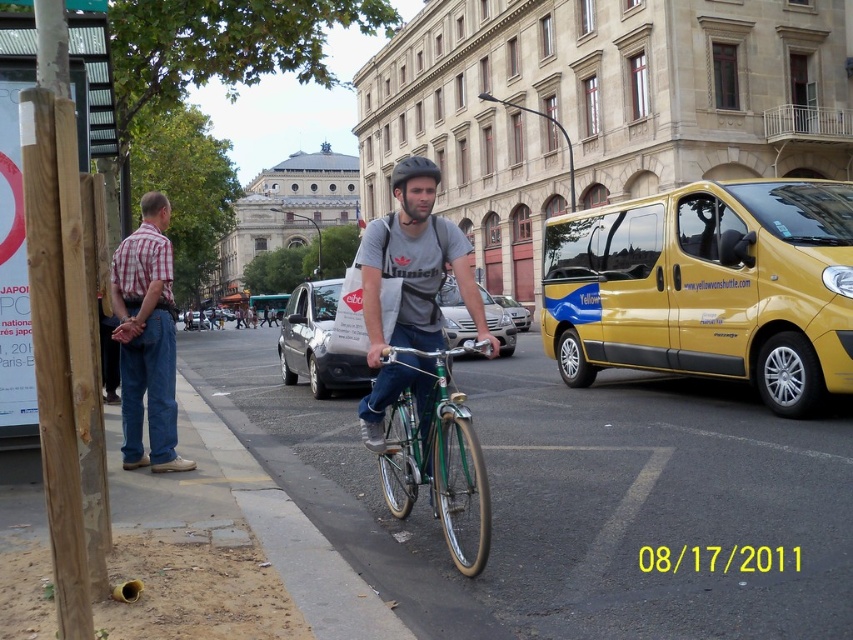
Can you confirm if green metallic bicycle at center is smaller than silver metallic van at center?

Yes.

Does green metallic bicycle at center have a greater height compared to silver metallic van at center?

No, green metallic bicycle at center is not taller than silver metallic van at center.

Find the location of a particular element. green metallic bicycle at center is located at coordinates (436, 452).

Where is `green metallic bicycle at center`? The image size is (853, 640). green metallic bicycle at center is located at coordinates (436, 452).

Is plaid shirt at left further to the viewer compared to matte gray van at center?

Yes.

Who is more forward, (111, 296) or (508, 330)?

Positioned in front is point (111, 296).

Who is more forward, (165,452) or (358,365)?

Point (165,452)

This screenshot has width=853, height=640. I want to click on plaid shirt at left, so click(x=146, y=339).

Does yellow metallic van at right have a greater width compared to matte black helmet at center?

Incorrect, yellow metallic van at right's width does not surpass matte black helmet at center's.

You are a GUI agent. You are given a task and a screenshot of the screen. Output one action in this format:
    pyautogui.click(x=<x>, y=<y>)
    Task: Click on the yellow metallic van at right
    The width and height of the screenshot is (853, 640).
    Given the screenshot: What is the action you would take?
    pyautogui.click(x=708, y=288)

You are a GUI agent. You are given a task and a screenshot of the screen. Output one action in this format:
    pyautogui.click(x=<x>, y=<y>)
    Task: Click on the yellow metallic van at right
    
    Given the screenshot: What is the action you would take?
    pyautogui.click(x=708, y=288)